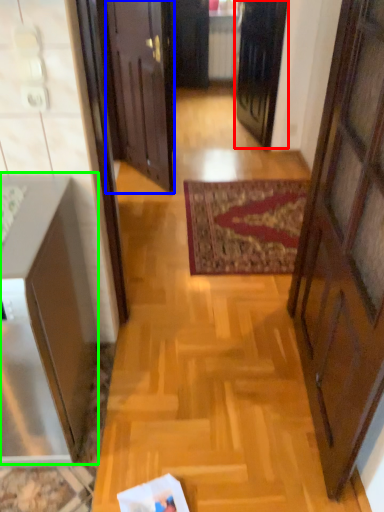
Question: Which object is positioned closest to door (highlighted by a red box)? Select from door (highlighted by a blue box) and cabinetry (highlighted by a green box).

Choices:
 (A) door
 (B) cabinetry

Answer: (A)